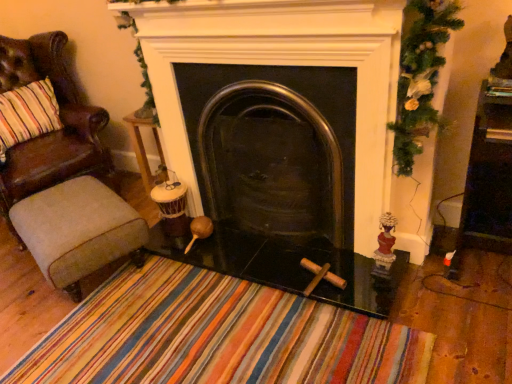
Question: Can you confirm if matte red figurine at right is taller than black glass fireplace at center?

Choices:
 (A) yes
 (B) no

Answer: (B)

Question: From the image's perspective, is matte red figurine at right above black glass fireplace at center?

Choices:
 (A) yes
 (B) no

Answer: (B)

Question: Can you confirm if matte red figurine at right is bigger than black glass fireplace at center?

Choices:
 (A) yes
 (B) no

Answer: (B)

Question: Is matte red figurine at right placed right next to black glass fireplace at center?

Choices:
 (A) yes
 (B) no

Answer: (B)

Question: Is matte red figurine at right facing towards black glass fireplace at center?

Choices:
 (A) no
 (B) yes

Answer: (A)

Question: From the image's perspective, is matte red figurine at right beneath black glass fireplace at center?

Choices:
 (A) yes
 (B) no

Answer: (A)

Question: Does black glass fireplace at center have a greater width compared to brown leather chair at left?

Choices:
 (A) yes
 (B) no

Answer: (B)

Question: From a real-world perspective, is black glass fireplace at center below brown leather chair at left?

Choices:
 (A) no
 (B) yes

Answer: (B)

Question: From a real-world perspective, is black glass fireplace at center over brown leather chair at left?

Choices:
 (A) yes
 (B) no

Answer: (B)

Question: Can you confirm if black glass fireplace at center is shorter than brown leather chair at left?

Choices:
 (A) yes
 (B) no

Answer: (A)

Question: From the image's perspective, is black glass fireplace at center over brown leather chair at left?

Choices:
 (A) yes
 (B) no

Answer: (B)

Question: Is black glass fireplace at center to the left of brown leather chair at left from the viewer's perspective?

Choices:
 (A) yes
 (B) no

Answer: (B)

Question: Can we say beige fabric stool at lower left lies outside green textured garland at upper right?

Choices:
 (A) yes
 (B) no

Answer: (A)